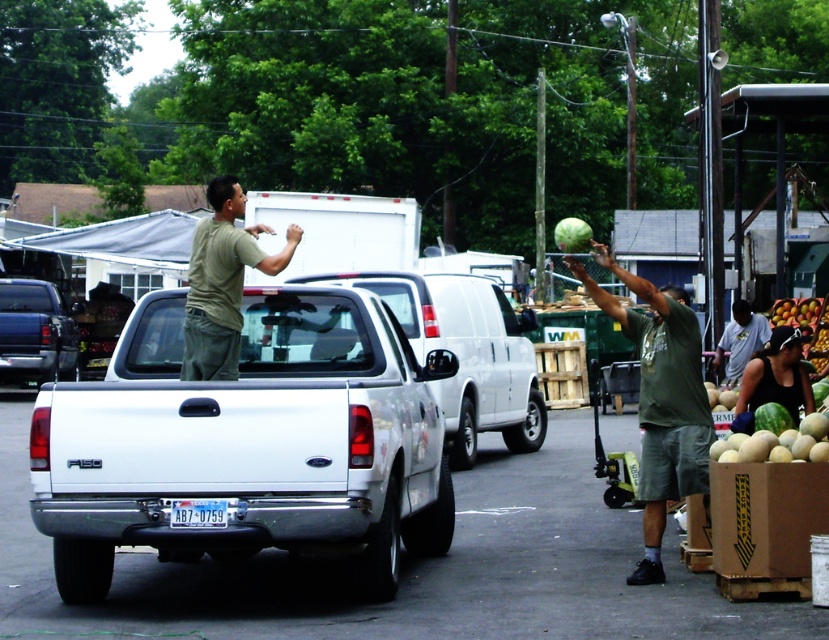
Question: Is white matte truck at center positioned before dark green t-shirt at center?

Choices:
 (A) yes
 (B) no

Answer: (A)

Question: Which object appears farthest from the camera in this image?

Choices:
 (A) green matte shirt at center
 (B) dark green t-shirt at center

Answer: (B)

Question: Which point is closer to the camera taking this photo?

Choices:
 (A) (755, 408)
 (B) (225, 332)
 (C) (521, 381)

Answer: (B)

Question: Which of the following is the farthest from the observer?

Choices:
 (A) white matte pickup truck at center
 (B) white matte truck at center
 (C) green matte watermelon at center
 (D) dark green t-shirt at center

Answer: (A)

Question: Is green matte watermelon at center wider than white plastic license plate at center?

Choices:
 (A) yes
 (B) no

Answer: (A)

Question: Can you confirm if green matte watermelon at center is positioned to the left of white plastic license plate at center?

Choices:
 (A) yes
 (B) no

Answer: (B)